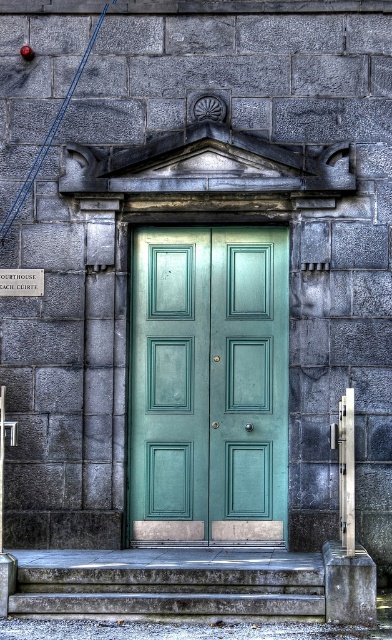
What do you see at coordinates (208, 385) in the screenshot? I see `teal glossy door at center` at bounding box center [208, 385].

Does teal glossy door at center have a lesser height compared to smooth concrete stairs at center?

Incorrect, teal glossy door at center's height does not fall short of smooth concrete stairs at center's.

Is point (246, 268) positioned before point (59, 580)?

No, (246, 268) is further to viewer.

I want to click on teal glossy door at center, so click(x=208, y=385).